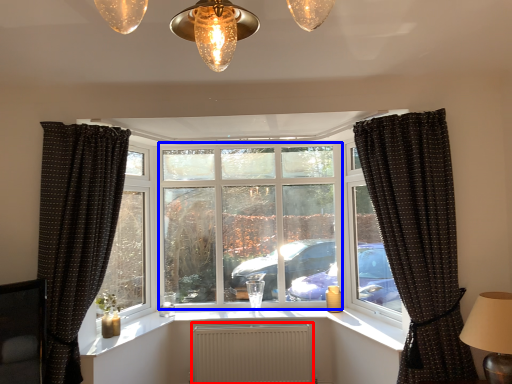
Question: Among these objects, which one is nearest to the camera, radiator (highlighted by a red box) or window screen (highlighted by a blue box)?

Choices:
 (A) radiator
 (B) window screen

Answer: (A)